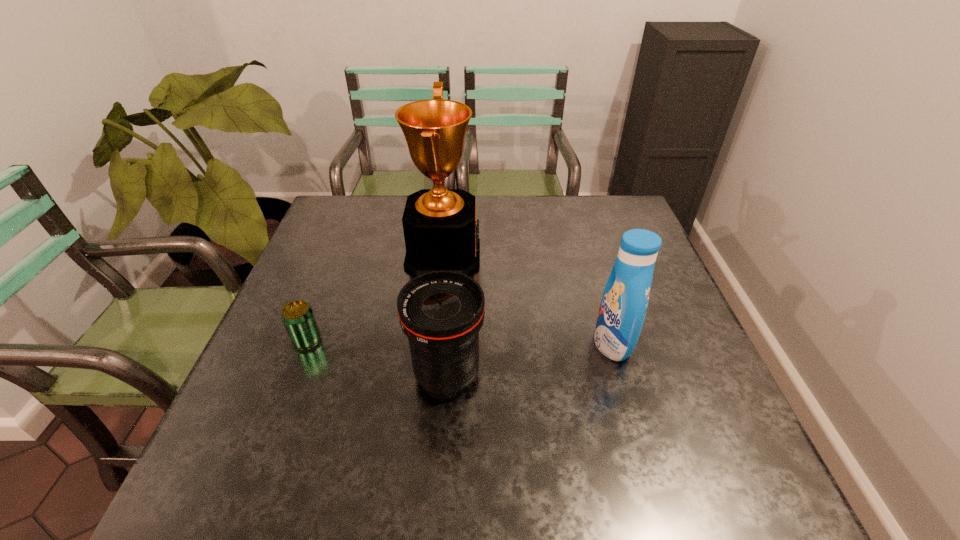
This screenshot has width=960, height=540. What are the coordinates of `free space in the image that satisfies the following two spatial constraints: 1. on the front side of the beer can; 2. on the left side of the telephoto lens` in the screenshot? It's located at (294, 374).

Find the location of `vacant space that satisfies the following two spatial constraints: 1. on the front side of the telephoto lens; 2. on the left side of the beer can`. vacant space that satisfies the following two spatial constraints: 1. on the front side of the telephoto lens; 2. on the left side of the beer can is located at coordinates (294, 374).